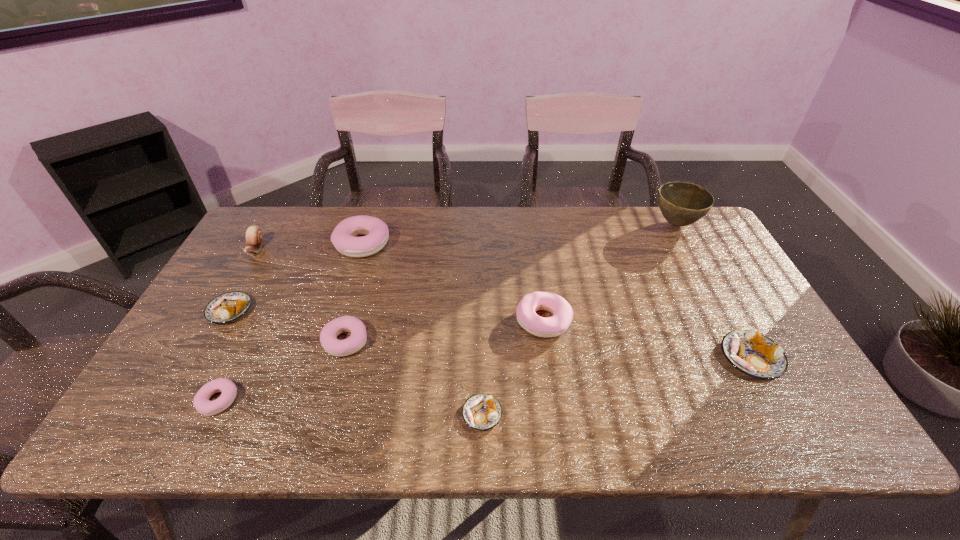
You are a GUI agent. You are given a task and a screenshot of the screen. Output one action in this format:
    pyautogui.click(x=<x>, y=<y>)
    Task: Click on the bowl
    
    Given the screenshot: What is the action you would take?
    pyautogui.click(x=681, y=203)

Where is `the tallest object`? The height and width of the screenshot is (540, 960). the tallest object is located at coordinates point(681,203).

You are a GUI agent. You are given a task and a screenshot of the screen. Output one action in this format:
    pyautogui.click(x=<x>, y=<y>)
    Task: Click on the escargot
    The image size is (960, 540).
    Given the screenshot: What is the action you would take?
    pyautogui.click(x=254, y=238)

The height and width of the screenshot is (540, 960). Identify the location of the farthest pink pastry. (343, 237).

Where is `the tallest pastry`? The height and width of the screenshot is (540, 960). the tallest pastry is located at coordinates (343, 237).

Where is `the seventh object from left to right`? the seventh object from left to right is located at coordinates [x=562, y=312].

Locate an element on the screen. This screenshot has width=960, height=540. the third smallest pink pastry is located at coordinates (562, 312).

Find the location of a particular element. the second nearest brown pastry is located at coordinates (754, 354).

What are the coordinates of `the rightmost brown pastry` in the screenshot? It's located at (754, 354).

Identify the location of the second smallest pink pastry. The image size is (960, 540). (357, 339).